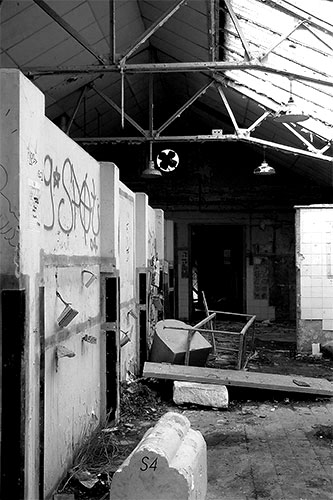
This screenshot has width=333, height=500. I want to click on light fixture, so click(x=68, y=317), click(x=93, y=278), click(x=127, y=338), click(x=260, y=170), click(x=150, y=170).